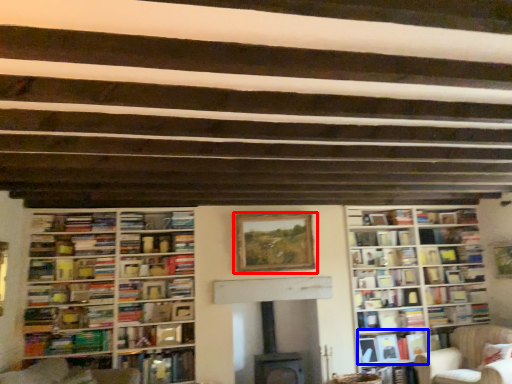
Question: Which object is closer to the camera taking this photo, picture frame (highlighted by a red box) or book (highlighted by a blue box)?

Choices:
 (A) picture frame
 (B) book

Answer: (A)